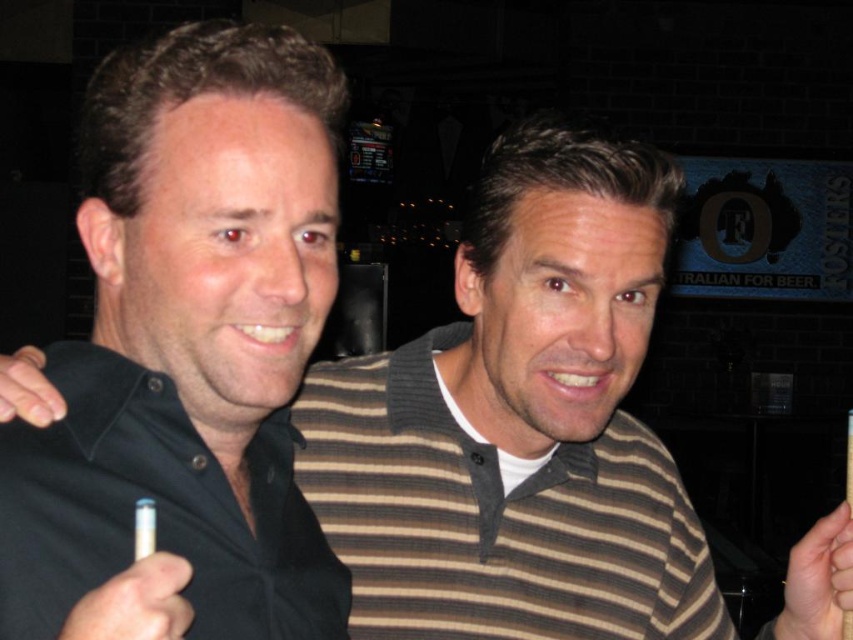
Can you confirm if black cotton polo shirt at left is smaller than white paper cigarette at lower left?

Incorrect, black cotton polo shirt at left is not smaller in size than white paper cigarette at lower left.

Describe the element at coordinates (155, 509) in the screenshot. The height and width of the screenshot is (640, 853). I see `black cotton polo shirt at left` at that location.

The width and height of the screenshot is (853, 640). Identify the location of black cotton polo shirt at left. (155, 509).